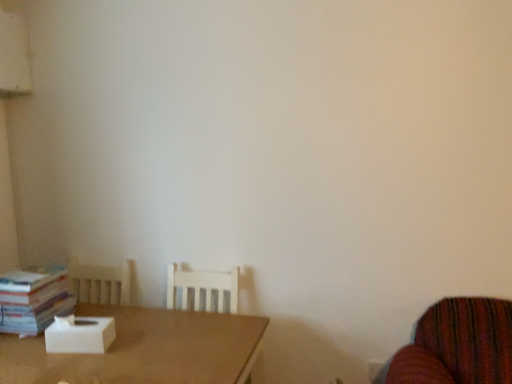
Question: From a real-world perspective, relative to white cardboard box at center, is brown matte table at lower left vertically above or below?

Choices:
 (A) above
 (B) below

Answer: (B)

Question: Is point (225, 370) closer or farther from the camera than point (51, 324)?

Choices:
 (A) closer
 (B) farther

Answer: (A)

Question: Which of these objects is positioned closest to the white cardboard box at center?

Choices:
 (A) white paper book at left
 (B) brown matte table at lower left

Answer: (B)

Question: Considering the real-world distances, which object is closest to the brown matte table at lower left?

Choices:
 (A) white paper book at left
 (B) white cardboard box at center

Answer: (B)